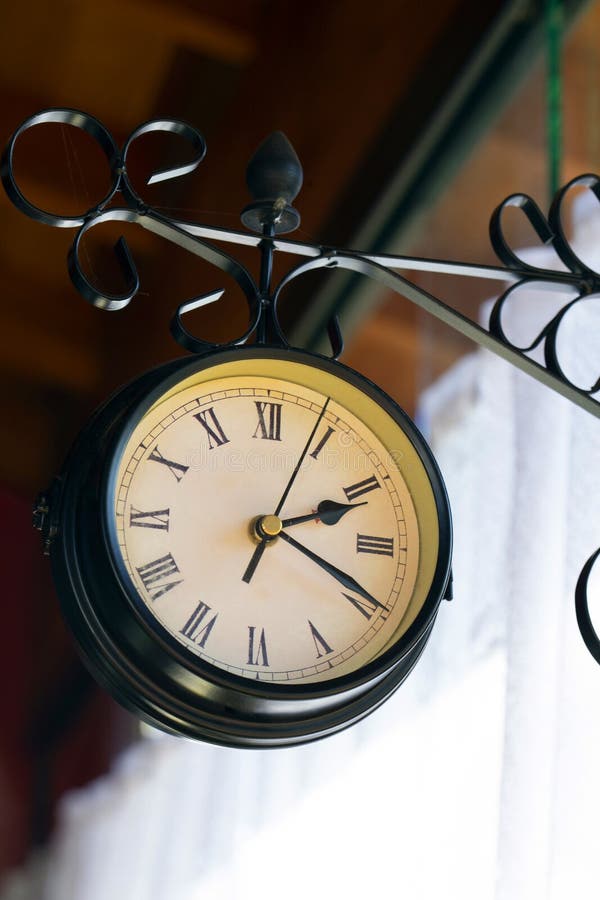
In order to click on blurry ceiling in this screenshot , I will do `click(257, 58)`.